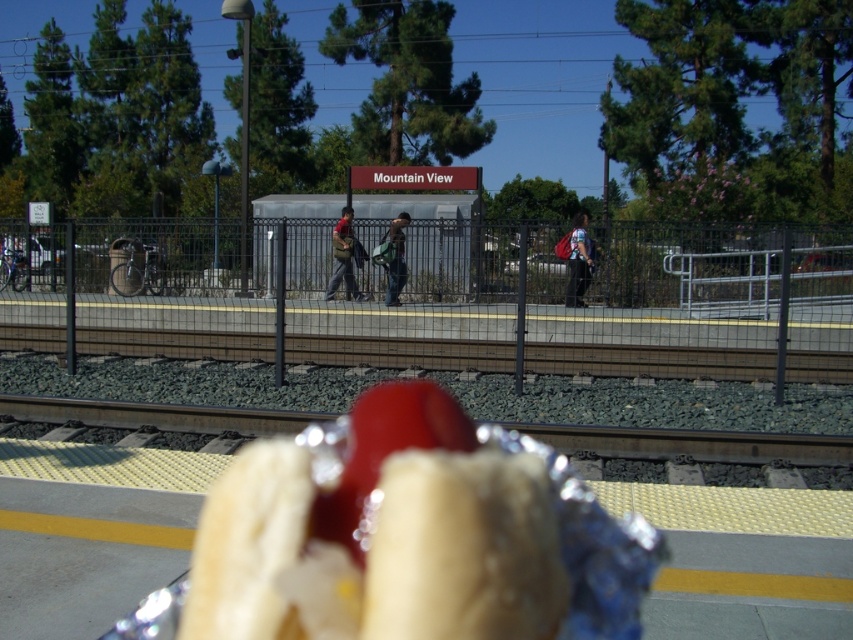
Which is above, shiny foil hot dog at center or green fabric backpack at center?

Positioned higher is green fabric backpack at center.

Can you confirm if shiny foil hot dog at center is bigger than green fabric backpack at center?

No, shiny foil hot dog at center is not bigger than green fabric backpack at center.

Is point (503, 522) closer to viewer compared to point (403, 221)?

Yes, it is.

You are a GUI agent. You are given a task and a screenshot of the screen. Output one action in this format:
    pyautogui.click(x=<x>, y=<y>)
    Task: Click on the shiny foil hot dog at center
    Image resolution: width=853 pixels, height=640 pixels.
    Given the screenshot: What is the action you would take?
    pyautogui.click(x=383, y=532)

Does matte brown backpack at center have a smaller size compared to green fabric backpack at center?

No, matte brown backpack at center is not smaller than green fabric backpack at center.

Which of these two, matte brown backpack at center or green fabric backpack at center, stands taller?

With more height is green fabric backpack at center.

Find the location of `matte brown backpack at center`. matte brown backpack at center is located at coordinates (343, 257).

Who is shorter, shiny foil hot dog at center or matte brown backpack at center?

shiny foil hot dog at center is shorter.

Between shiny foil hot dog at center and matte brown backpack at center, which one is positioned lower?

Positioned lower is shiny foil hot dog at center.

Find the location of a particular element. This screenshot has width=853, height=640. shiny foil hot dog at center is located at coordinates (383, 532).